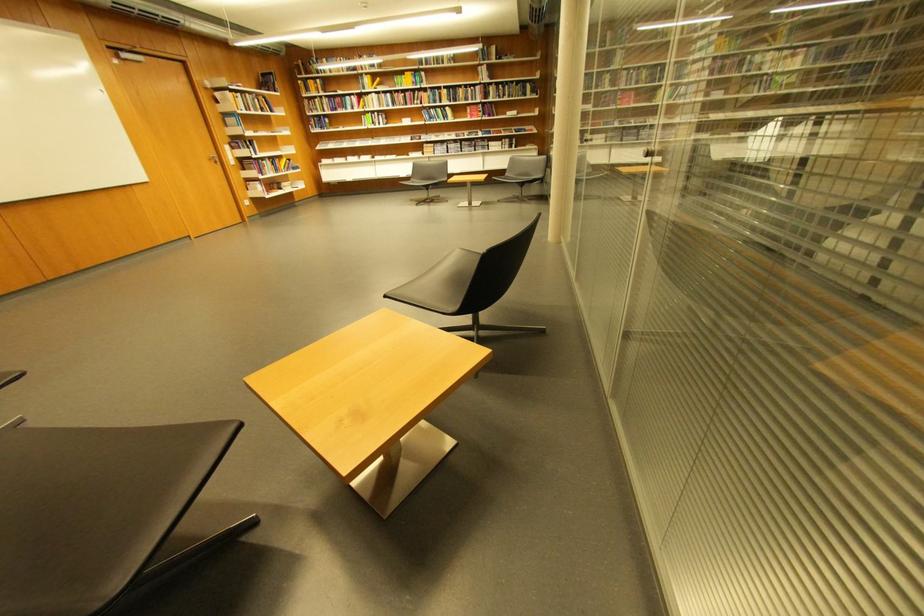
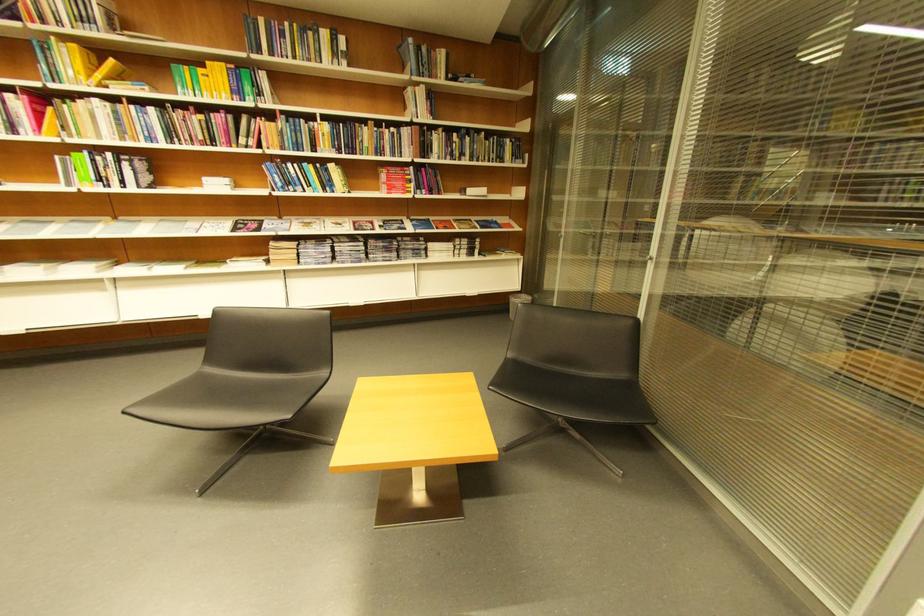
In the second image, find the point that corresponds to [380,78] in the first image.

(84, 47)